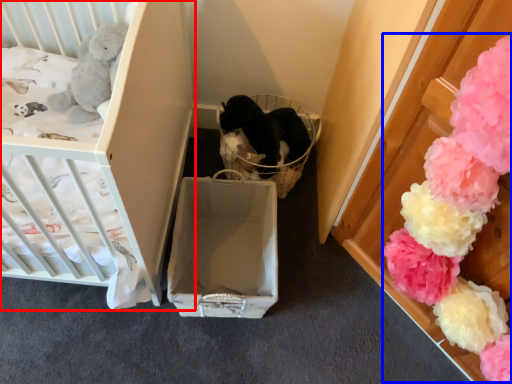
Question: Which object appears farthest to the camera in this image, infant bed (highlighted by a red box) or flower (highlighted by a blue box)?

Choices:
 (A) infant bed
 (B) flower

Answer: (A)